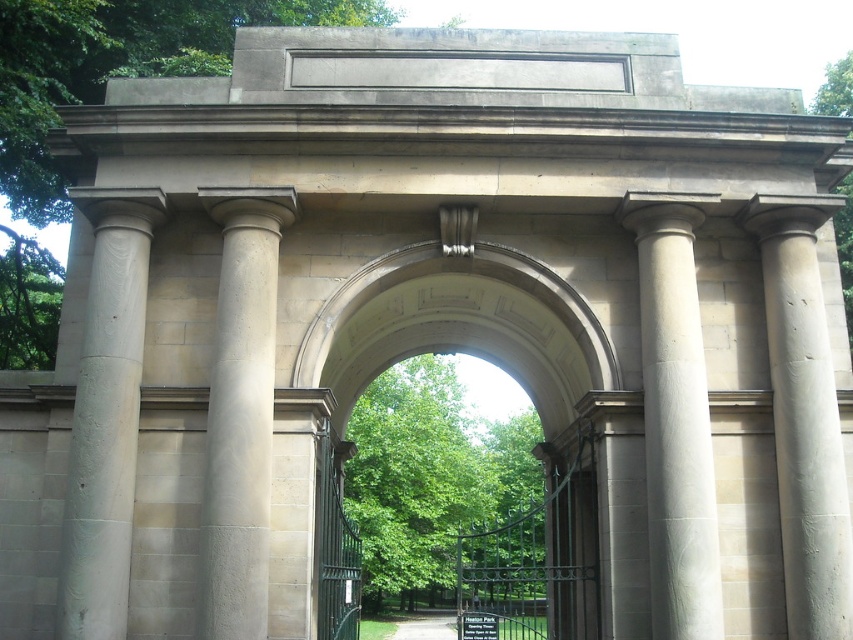
Can you confirm if green leafy tree at center is positioned to the right of green wrought iron gate at center?

Correct, you'll find green leafy tree at center to the right of green wrought iron gate at center.

Does point (401, 490) come behind point (335, 614)?

That is True.

Locate an element on the screen. Image resolution: width=853 pixels, height=640 pixels. green leafy tree at center is located at coordinates (428, 474).

What do you see at coordinates (804, 417) in the screenshot? The image size is (853, 640). I see `smooth stone column at right` at bounding box center [804, 417].

Does smooth stone column at right appear on the left side of green leafy tree at left?

In fact, smooth stone column at right is to the right of green leafy tree at left.

Find the location of `smooth stone column at right`. smooth stone column at right is located at coordinates [x=804, y=417].

Is green leafy tree at center positioned in front of green grass at center?

Yes.

In the scene shown: Can you confirm if green leafy tree at center is shorter than green grass at center?

In fact, green leafy tree at center may be taller than green grass at center.

Between point (370, 438) and point (445, 632), which one is positioned in front?

Point (445, 632) is more forward.

Locate an element on the screen. green leafy tree at center is located at coordinates pyautogui.click(x=428, y=474).